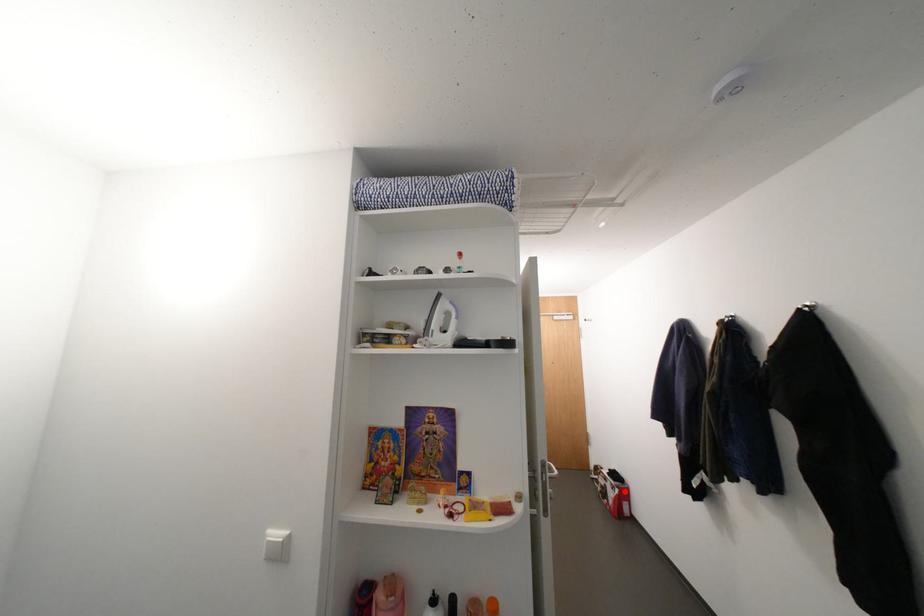
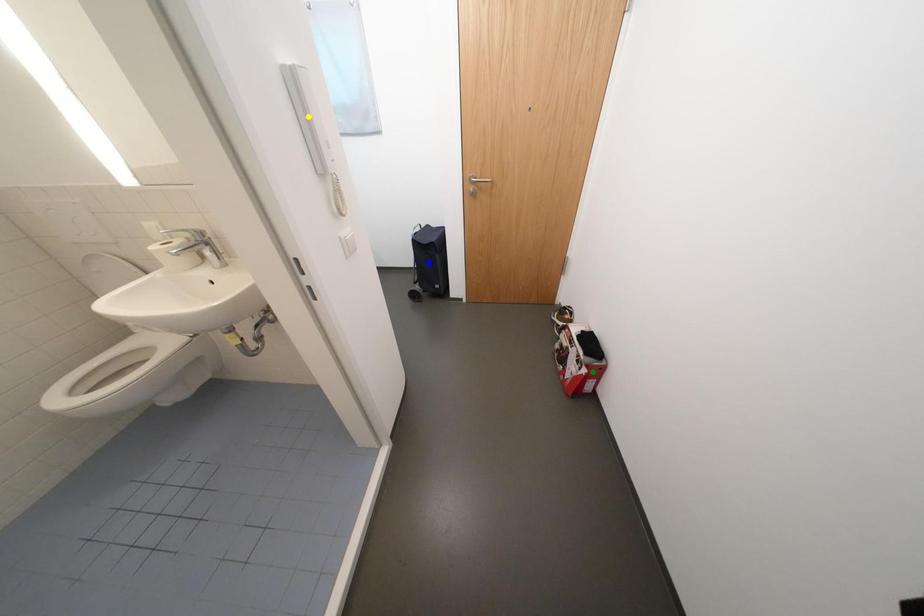
Question: I am providing you with two images of the same scene from different viewpoints. A red point is marked on the first image. You are given multiple points on the second image. Which point in image 2 represents the same 3d spot as the red point in image 1?

Choices:
 (A) yellow point
 (B) green point
 (C) blue point

Answer: (B)